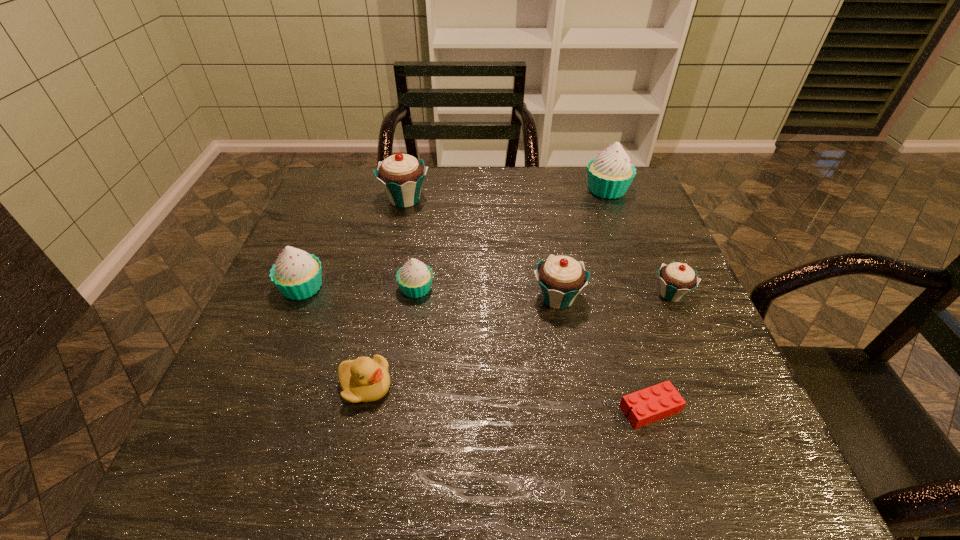
Where is `free spot between the leftmost object and the red Lego`? free spot between the leftmost object and the red Lego is located at coordinates (476, 348).

Locate an element on the screen. This screenshot has width=960, height=540. vacant area that lies between the yellow duckling and the smallest white cupcake is located at coordinates (391, 338).

Where is `blank region between the yellow duckling and the second white cupcake from right to left`? Image resolution: width=960 pixels, height=540 pixels. blank region between the yellow duckling and the second white cupcake from right to left is located at coordinates (391, 338).

Where is `empty space that is in between the duckling and the rightmost teal cupcake`? The image size is (960, 540). empty space that is in between the duckling and the rightmost teal cupcake is located at coordinates (518, 340).

At what (x,y) coordinates should I click in order to perform the action: click on vacant area between the red Lego and the rightmost teal cupcake. Please return your answer as a coordinate pair (x, y). Looking at the image, I should click on (660, 352).

Identify the location of vacant area between the farthest teal cupcake and the third cupcake from right to left. This screenshot has height=540, width=960. (481, 249).

This screenshot has height=540, width=960. I want to click on free space between the biggest white cupcake and the smallest teal cupcake, so click(639, 242).

Find the location of `free space between the leftmost object and the second biggest teal cupcake`. free space between the leftmost object and the second biggest teal cupcake is located at coordinates (430, 293).

This screenshot has height=540, width=960. What are the coordinates of `free space between the rightmost teal cupcake and the leftmost cupcake` in the screenshot? It's located at (487, 291).

Locate an element on the screen. unoccupied area between the shortest object and the rightmost teal cupcake is located at coordinates (660, 352).